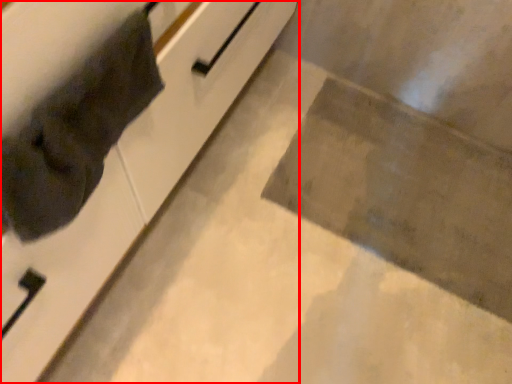
Question: From the image's perspective, where is cabinetry (annotated by the red box) located in relation to cat in the image?

Choices:
 (A) below
 (B) above

Answer: (B)